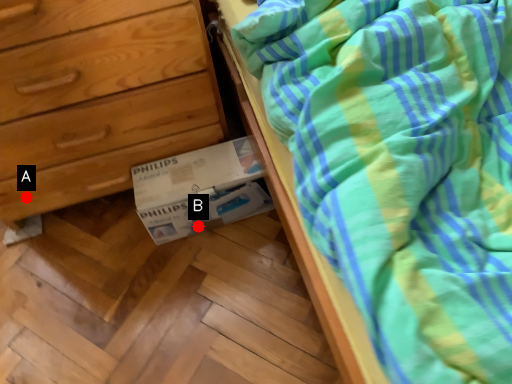
Question: Two points are circled on the image, labeled by A and B beside each circle. Which point is farther to the camera?

Choices:
 (A) A is further
 (B) B is further

Answer: (B)